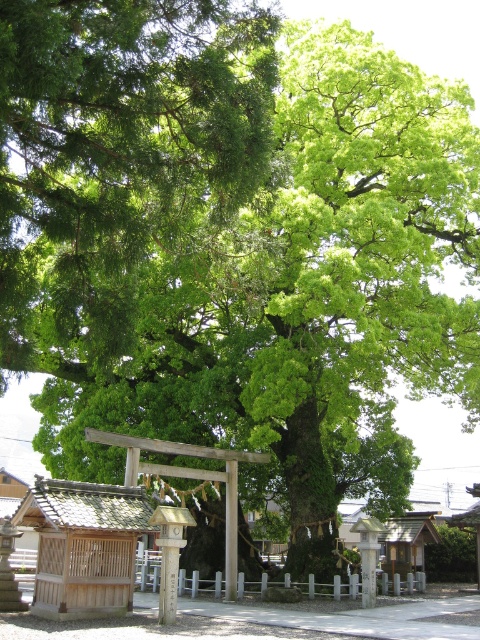
You are a visitor at the shrine and want to take a photo of the wooden shrine at lower left and the white stone pillar at center. From your current position, which object should you look up or down to capture both in the frame?

The wooden shrine at lower left is above the white stone pillar at center, so you should look up to include both in the frame.